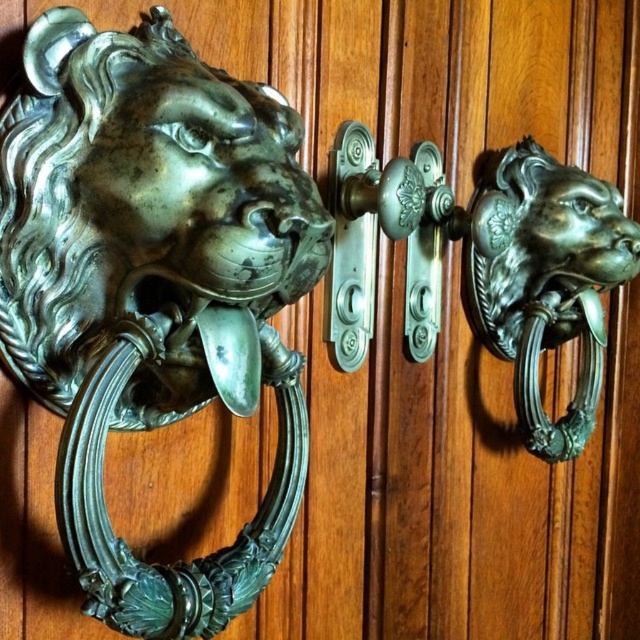
You are standing in front of the door with the lion head door knockers. There is a point marked at coordinates (141, 195). Which object is this point located on?

The point at (141, 195) is located on the green patina metal lion head at left.

You are a painter standing 30 inches away from the green patina metal lion head at left. Can you reach it with your 12 inch long paintbrush?

The green patina metal lion head at left is 29.45 inches away from the viewer. Since you are standing 30 inches away, your paintbrush can reach it as the distance is slightly less than the brush length.

You are a guest approaching the door with two lion head door knockers. You notice that one is labeled as the green patina metal lion head at left and the other as the green patina metal lion head knocker at left. Which one is positioned further to the left side of the door?

The green patina metal lion head at left is positioned further to the left side of the door compared to the green patina metal lion head knocker at left.